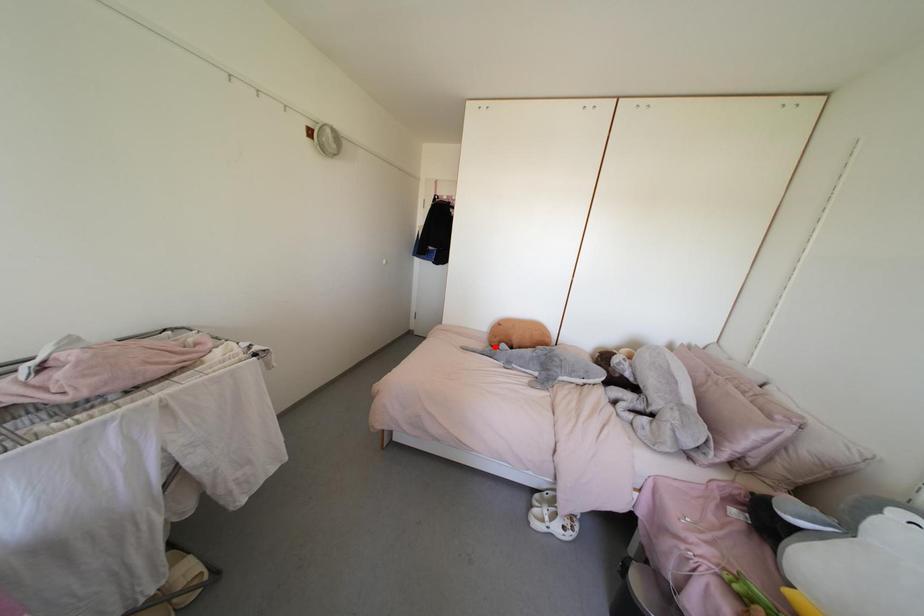
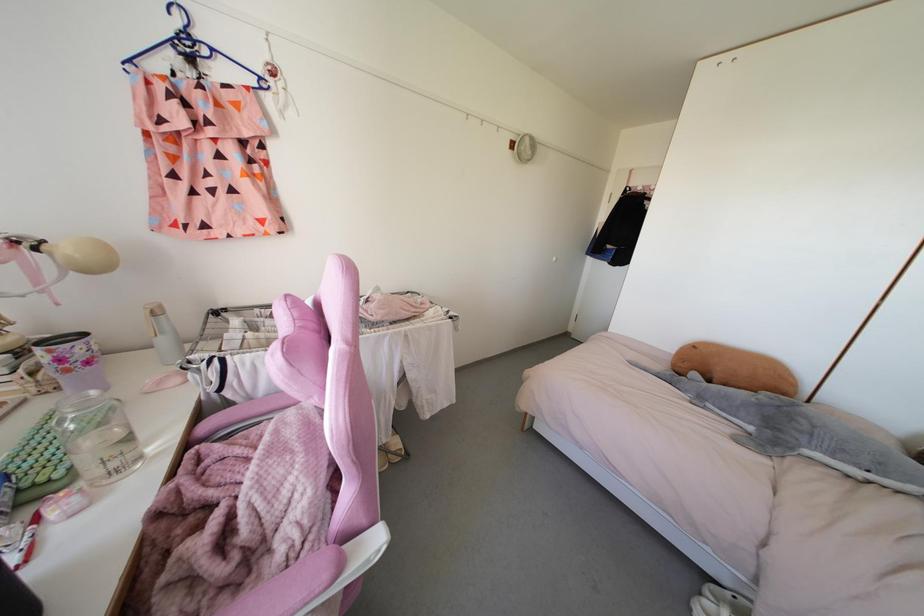
Find the pixel in the second image that matches the highlighted location in the first image.

(679, 374)